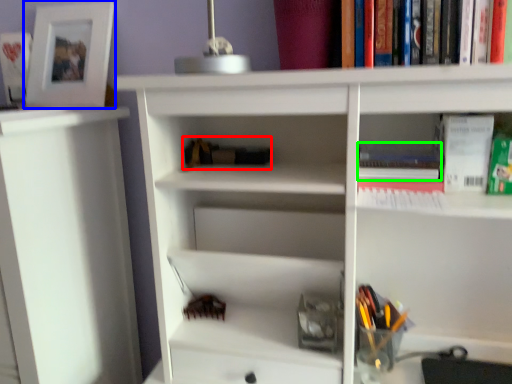
Question: Which is nearer to the book (highlighted by a red box)? picture frame (highlighted by a blue box) or book (highlighted by a green box).

Choices:
 (A) picture frame
 (B) book

Answer: (B)